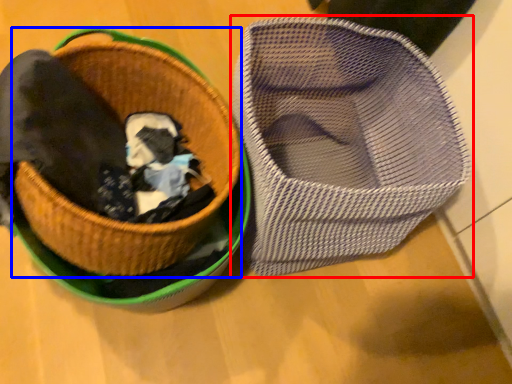
Question: Which of the following is the closest to the observer, footwear (highlighted by a red box) or basket (highlighted by a blue box)?

Choices:
 (A) footwear
 (B) basket

Answer: (B)